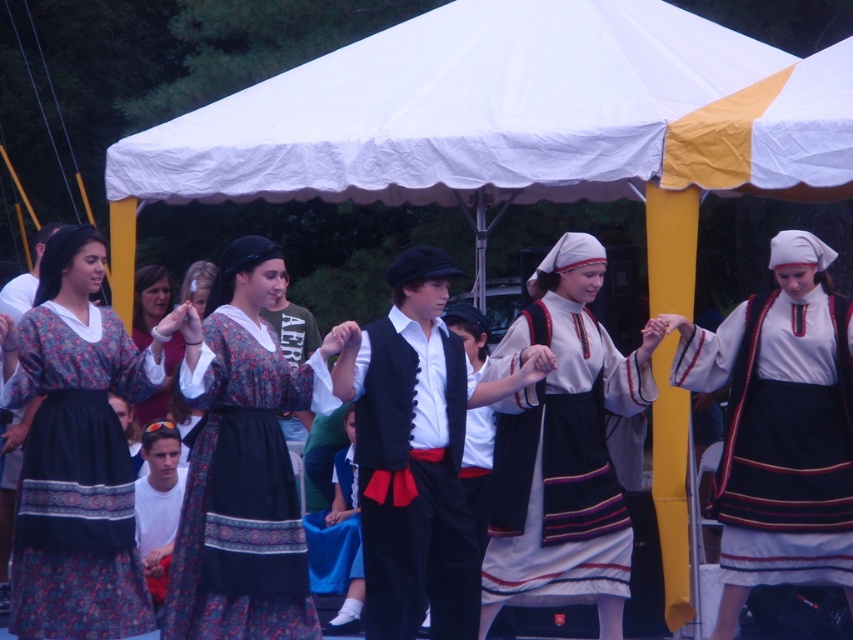
Question: Which point is farther to the camera?

Choices:
 (A) matte blue dress at center
 (B) black satin vest at center

Answer: (A)

Question: Which point is farther to the camera?

Choices:
 (A) (212, 340)
 (B) (405, 396)
 (C) (795, 467)

Answer: (C)

Question: Can you confirm if printed fabric dress at center is wider than matte white dress at center?

Choices:
 (A) yes
 (B) no

Answer: (B)

Question: Is printed fabric dress at center wider than matte floral dress at center?

Choices:
 (A) no
 (B) yes

Answer: (B)

Question: Which object is closer to the camera taking this photo?

Choices:
 (A) matte floral dress at center
 (B) matte white dress at center

Answer: (A)

Question: Is matte floral dress at center bigger than black satin vest at center?

Choices:
 (A) no
 (B) yes

Answer: (B)